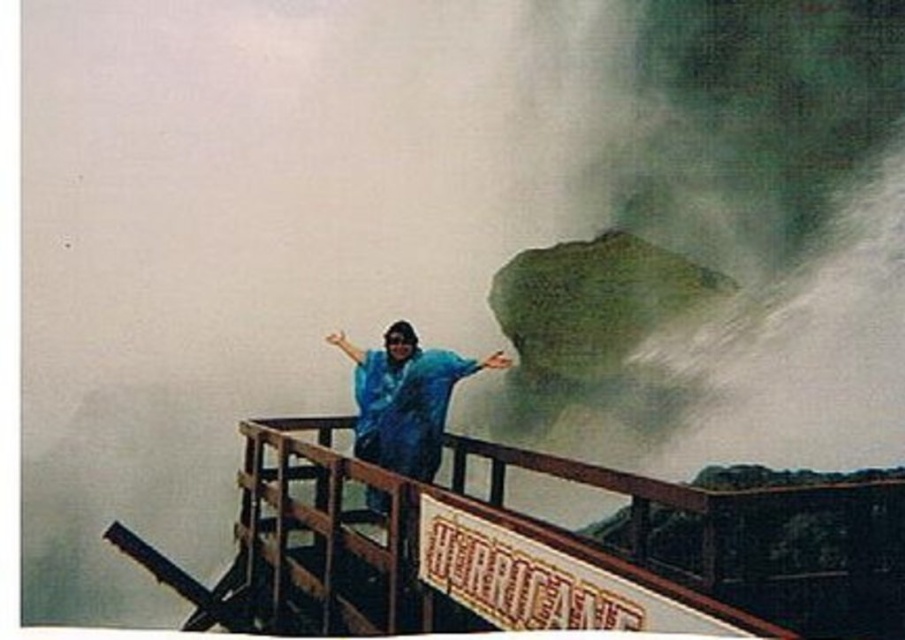
Question: Where is brown wooden rail at center located in relation to blue waterproof jacket at center in the image?

Choices:
 (A) right
 (B) left

Answer: (B)

Question: Which of the following is the farthest from the observer?

Choices:
 (A) blue waterproof jacket at center
 (B) brown wooden rail at center

Answer: (A)

Question: Does brown wooden rail at center appear over blue waterproof jacket at center?

Choices:
 (A) no
 (B) yes

Answer: (A)

Question: Is brown wooden rail at center closer to the viewer compared to blue waterproof jacket at center?

Choices:
 (A) no
 (B) yes

Answer: (B)

Question: Among these points, which one is nearest to the camera?

Choices:
 (A) (376, 509)
 (B) (881, 582)

Answer: (B)

Question: Among these objects, which one is nearest to the camera?

Choices:
 (A) brown wooden rail at center
 (B) blue waterproof jacket at center

Answer: (A)